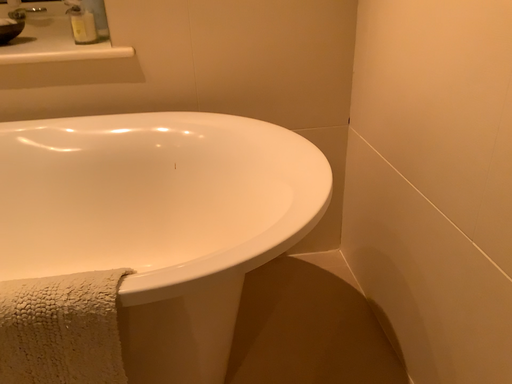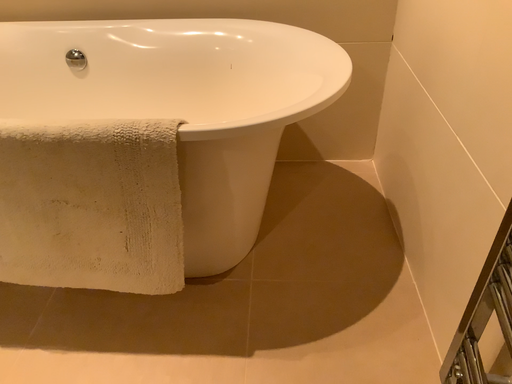
Question: How did the camera likely rotate when shooting the video?

Choices:
 (A) rotated left
 (B) rotated right

Answer: (A)